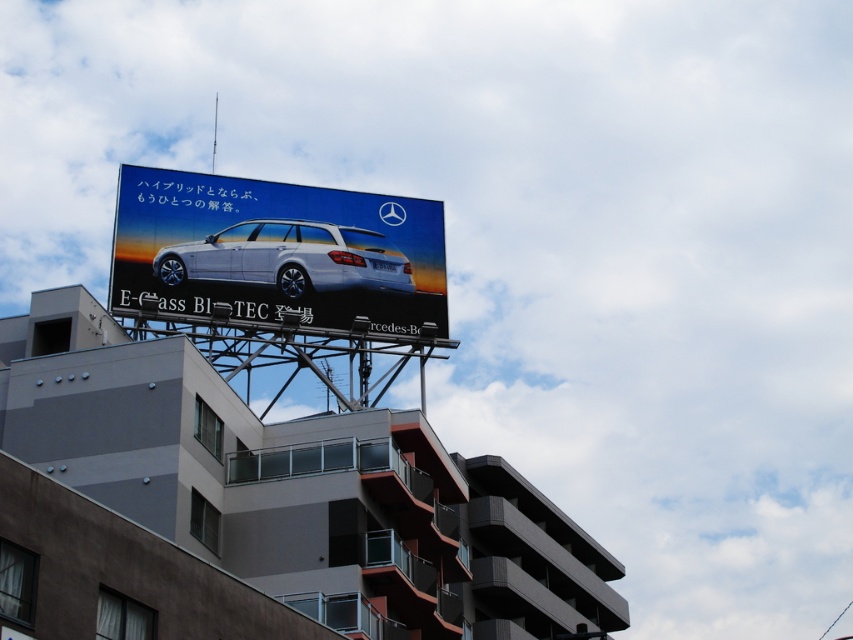
You are a photographer standing on the sidewalk below the billboard. You want to take a photo of the white glossy car at upper center and the white glossy wagon at center. Which object should you focus on first if you want to capture both in a single frame without moving your camera?

You should focus on the white glossy wagon at center first because it is lower and closer to the camera, making it easier to include both objects in the frame without moving the camera.